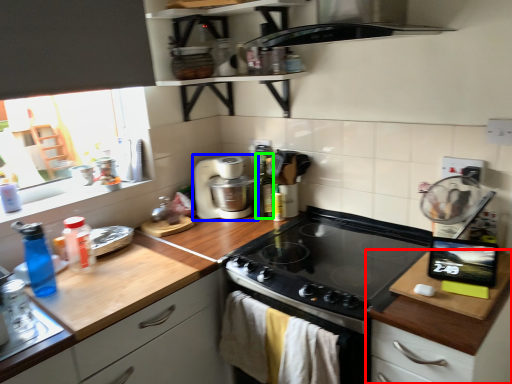
Question: Estimate the real-world distances between objects in this image. Which object is farther from cabinetry (highlighted by a red box), home appliance (highlighted by a blue box) or bottle (highlighted by a green box)?

Choices:
 (A) home appliance
 (B) bottle

Answer: (A)